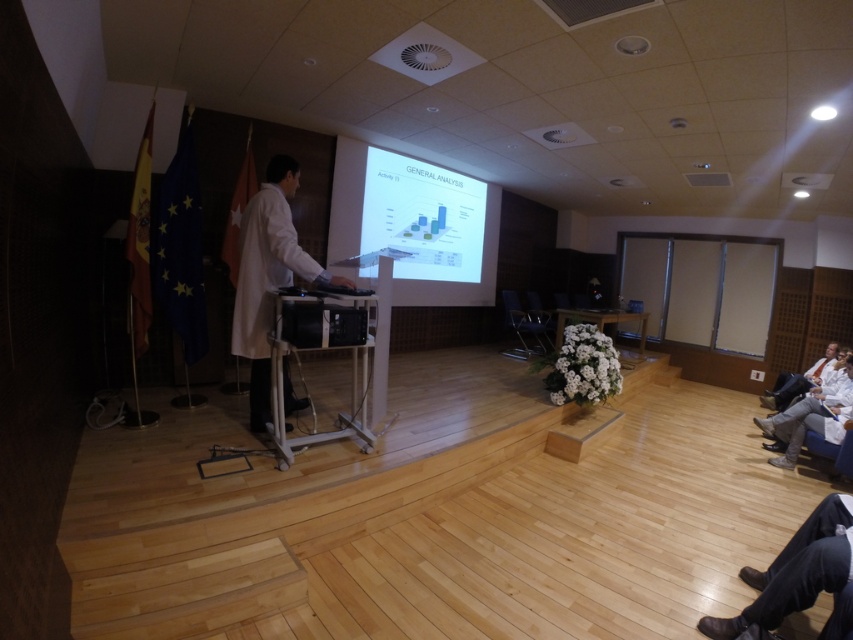
You are attending a presentation in the conference room and notice the white matte coat at center and the black plastic chair at center. Which object is taller?

The white matte coat at center is taller than the black plastic chair at center.

You are sitting in the audience and want to hand a note to the speaker who is wearing the white matte coat at center. Since you can only move around the white plastic podium at center, which direction should you go to reach the speaker?

The white matte coat at center is to the left of the white plastic podium at center, so you should move to the left side of the white plastic podium at center to reach the speaker.

You are organizing a presentation and need to place a decorative plant between the white matte coat at center and the black plastic chair at center. Since the coat is narrower than the chair, which object should you position closer to the plant to ensure symmetry?

The white matte coat at center has a lesser width compared to the black plastic chair at center, so positioning the plant closer to the coat would create symmetry between the two objects.